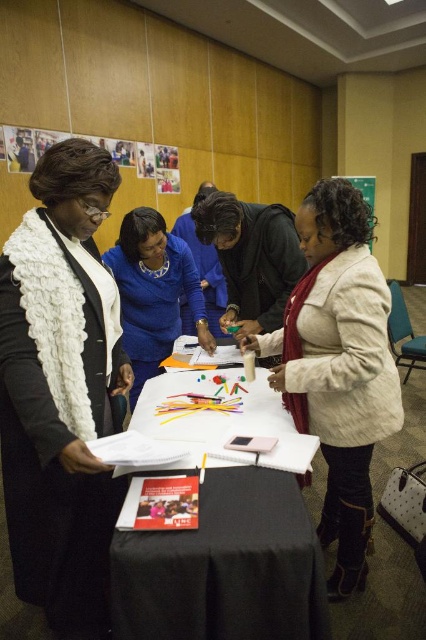
You are a participant in the conference and need to retrieve a document pinned on the green matte bulletin board at upper center. You are currently standing next to the blue fabric shirt at center. Can you reach the bulletin board without moving from your current position?

The distance between the blue fabric shirt at center and the green matte bulletin board at upper center is 5.56 meters. Since you cannot reach that far without moving, you will need to move closer to access the bulletin board.

You are a participant in the conference and you need to access the white paper at center. However, the white textured coat at center is blocking it. Can you lift the coat to retrieve the paper?

The white paper at center is below the white textured coat at center, so yes, you can lift the white textured coat at center to access the white paper at center.